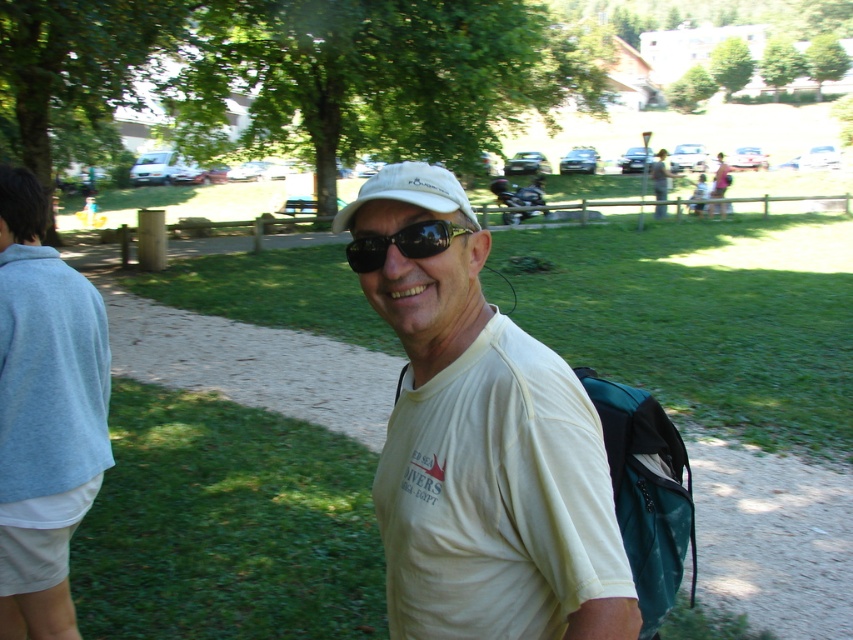
Question: Among these objects, which one is farthest from the camera?

Choices:
 (A) white matte t-shirt at center
 (B) matte white shirt at upper center
 (C) teal fabric backpack at right

Answer: (B)

Question: Does teal fabric backpack at right have a smaller size compared to white fabric cap at center?

Choices:
 (A) yes
 (B) no

Answer: (A)

Question: In this image, where is white matte t-shirt at center located relative to gray cotton sweatshirt at left?

Choices:
 (A) right
 (B) left

Answer: (A)

Question: Which point is farther to the camera?

Choices:
 (A) matte white shirt at upper center
 (B) white matte t-shirt at center
 (C) white fabric cap at center

Answer: (A)

Question: Can you confirm if white matte t-shirt at center is smaller than teal fabric backpack at right?

Choices:
 (A) yes
 (B) no

Answer: (A)

Question: Estimate the real-world distances between objects in this image. Which object is closer to the gray cotton sweatshirt at left?

Choices:
 (A) matte white shirt at upper center
 (B) teal fabric backpack at right

Answer: (B)